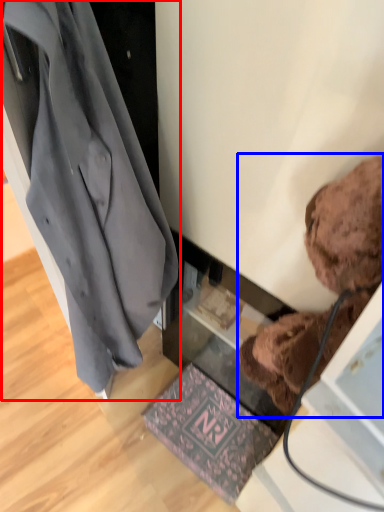
Question: Among these objects, which one is nearest to the camera, coat (highlighted by a red box) or teddy bear (highlighted by a blue box)?

Choices:
 (A) coat
 (B) teddy bear

Answer: (B)